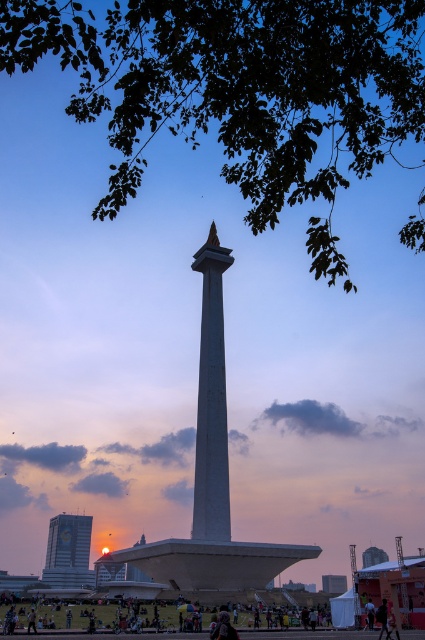
Does green leafy tree at upper center have a lesser width compared to dark clothing at lower center?

Incorrect, green leafy tree at upper center's width is not less than dark clothing at lower center's.

Who is more distant from viewer, (142, 10) or (252, 628)?

The point (252, 628) is more distant.

Based on the photo, who is more distant from viewer, (172, 77) or (268, 632)?

The point (172, 77) is more distant.

Where is `green leafy tree at upper center`? green leafy tree at upper center is located at coordinates (240, 90).

Which is behind, point (8, 0) or point (204, 490)?

Positioned behind is point (204, 490).

Does green leafy tree at upper center appear over white stone tower at center?

Correct, green leafy tree at upper center is located above white stone tower at center.

Where is `green leafy tree at upper center`? The width and height of the screenshot is (425, 640). green leafy tree at upper center is located at coordinates (240, 90).

Identify the location of green leafy tree at upper center. (240, 90).

Which is behind, point (362, 556) or point (379, 614)?

The point (362, 556) is more distant.

Identify the location of white concrete tower at center. (374, 556).

At what (x,y) coordinates should I click in order to perform the action: click on white concrete tower at center. Please return your answer as a coordinate pair (x, y). The image size is (425, 640). Looking at the image, I should click on (374, 556).